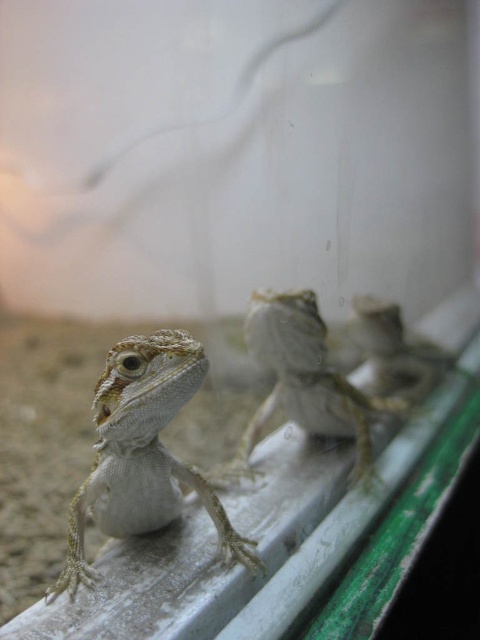
Question: Is white matte lizard at center wider than smooth beige lizard at center?

Choices:
 (A) no
 (B) yes

Answer: (A)

Question: Is white matte lizard at center positioned at the back of smooth beige lizard at center?

Choices:
 (A) no
 (B) yes

Answer: (A)

Question: Does white matte lizard at center have a smaller size compared to smooth beige lizard at center?

Choices:
 (A) no
 (B) yes

Answer: (B)

Question: Which point appears closest to the camera in this image?

Choices:
 (A) (267, 396)
 (B) (186, 401)

Answer: (B)

Question: Which of the following is the farthest from the observer?

Choices:
 (A) (155, 456)
 (B) (255, 307)

Answer: (B)

Question: Among these points, which one is nearest to the camera?

Choices:
 (A) (175, 381)
 (B) (248, 454)

Answer: (A)